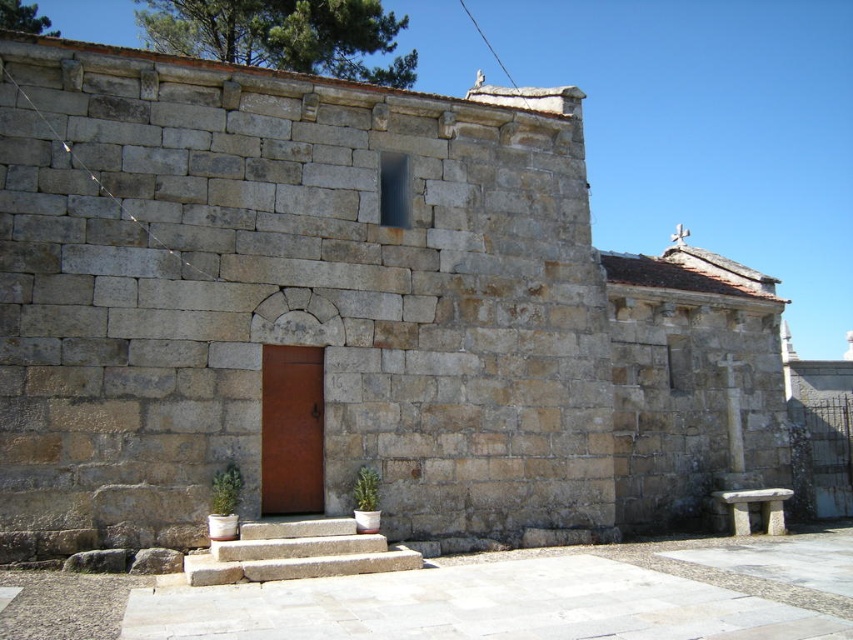
Is rusty metal door at center in front of green leafy plant at lower center?

No.

Which is behind, point (273, 460) or point (221, 472)?

Point (273, 460)

Locate an element on the screen. This screenshot has height=640, width=853. rusty metal door at center is located at coordinates (291, 429).

Can you confirm if green leafy plant at lower center is positioned above green leafy plant at center?

Indeed, green leafy plant at lower center is positioned over green leafy plant at center.

In order to click on green leafy plant at lower center in this screenshot , I will do (225, 490).

Who is higher up, natural stone stairs at center or green leafy plant at lower center?

green leafy plant at lower center is above.

You are a GUI agent. You are given a task and a screenshot of the screen. Output one action in this format:
    pyautogui.click(x=<x>, y=<y>)
    Task: Click on the natural stone stairs at center
    This screenshot has height=640, width=853.
    Given the screenshot: What is the action you would take?
    pyautogui.click(x=296, y=552)

The height and width of the screenshot is (640, 853). I want to click on natural stone stairs at center, so click(296, 552).